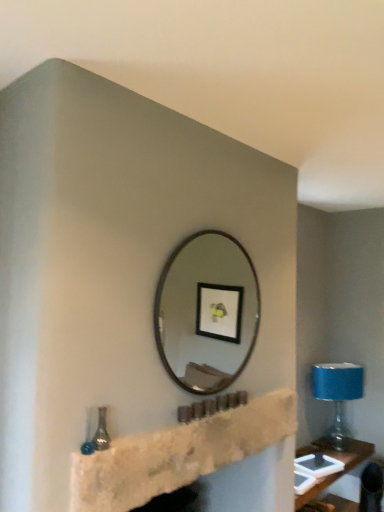
Question: Does blue fabric lampshade at right have a lesser width compared to stone fireplace at center?

Choices:
 (A) no
 (B) yes

Answer: (A)

Question: Does blue fabric lampshade at right have a greater width compared to stone fireplace at center?

Choices:
 (A) no
 (B) yes

Answer: (B)

Question: Is blue fabric lampshade at right in contact with stone fireplace at center?

Choices:
 (A) no
 (B) yes

Answer: (A)

Question: Does blue fabric lampshade at right lie in front of stone fireplace at center?

Choices:
 (A) yes
 (B) no

Answer: (B)

Question: Could you tell me if blue fabric lampshade at right is facing stone fireplace at center?

Choices:
 (A) yes
 (B) no

Answer: (B)

Question: Is the position of blue fabric lampshade at right more distant than that of stone fireplace at center?

Choices:
 (A) yes
 (B) no

Answer: (A)

Question: From the image's perspective, is blue fabric lampshade at right located beneath metallic silver mirror at center?

Choices:
 (A) no
 (B) yes

Answer: (B)

Question: Would you say metallic silver mirror at center is part of blue fabric lampshade at right's contents?

Choices:
 (A) no
 (B) yes

Answer: (A)

Question: Can you confirm if blue fabric lampshade at right is positioned to the right of metallic silver mirror at center?

Choices:
 (A) no
 (B) yes

Answer: (B)

Question: Is blue fabric lampshade at right outside metallic silver mirror at center?

Choices:
 (A) yes
 (B) no

Answer: (A)

Question: Is blue fabric lampshade at right wider than metallic silver mirror at center?

Choices:
 (A) no
 (B) yes

Answer: (B)

Question: From a real-world perspective, is blue fabric lampshade at right located beneath metallic silver mirror at center?

Choices:
 (A) yes
 (B) no

Answer: (A)

Question: Does metallic silver mirror at center lie behind blue fabric lampshade at right?

Choices:
 (A) yes
 (B) no

Answer: (B)